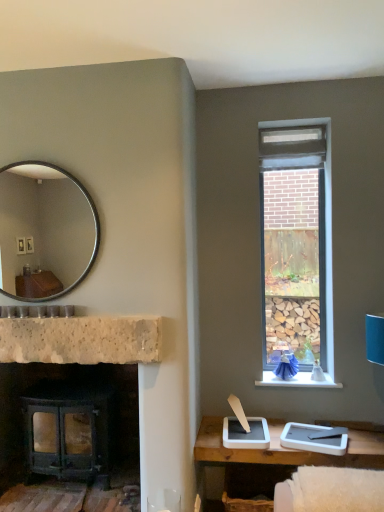
You are a GUI agent. You are given a task and a screenshot of the screen. Output one action in this format:
    pyautogui.click(x=<x>, y=<y>)
    Task: Click on the white stone window sill at upper right
    The image size is (384, 512).
    Given the screenshot: What is the action you would take?
    pyautogui.click(x=297, y=381)

Measure the distance between silver metallic mirror at upper left and camera.

silver metallic mirror at upper left and camera are 3.15 meters apart.

Measure the distance between matte black wood-burning stove at lower left and camera.

matte black wood-burning stove at lower left and camera are 2.28 meters apart.

Image resolution: width=384 pixels, height=512 pixels. What do you see at coordinates (81, 340) in the screenshot? I see `natural stone fireplace at center` at bounding box center [81, 340].

Locate an element on the screen. This screenshot has height=512, width=384. white stone window sill at upper right is located at coordinates (297, 381).

From a real-world perspective, relative to silver metallic mirror at upper left, is white stone window sill at upper right vertically above or below?

white stone window sill at upper right is below silver metallic mirror at upper left.

From the image's perspective, which is above, white stone window sill at upper right or silver metallic mirror at upper left?

silver metallic mirror at upper left.

Is white stone window sill at upper right to the left of silver metallic mirror at upper left from the viewer's perspective?

No, white stone window sill at upper right is not to the left of silver metallic mirror at upper left.

Could you tell me if white stone window sill at upper right is facing silver metallic mirror at upper left?

No, white stone window sill at upper right is not turned towards silver metallic mirror at upper left.

From a real-world perspective, between matte black wood-burning stove at lower left and white stone window sill at upper right, who is vertically lower?

matte black wood-burning stove at lower left.

Measure the distance from matte black wood-burning stove at lower left to white stone window sill at upper right.

matte black wood-burning stove at lower left and white stone window sill at upper right are 3.88 feet apart.

In the image, is matte black wood-burning stove at lower left positioned in front of or behind white stone window sill at upper right?

matte black wood-burning stove at lower left is in front of white stone window sill at upper right.

Is matte black wood-burning stove at lower left positioned with its back to natural stone fireplace at center?

matte black wood-burning stove at lower left does not have its back to natural stone fireplace at center.

Is matte black wood-burning stove at lower left to the left of natural stone fireplace at center from the viewer's perspective?

Yes.

Is matte black wood-burning stove at lower left not within natural stone fireplace at center?

Yes, matte black wood-burning stove at lower left is located beyond the bounds of natural stone fireplace at center.

Is silver metallic mirror at upper left to the left of white stone window sill at upper right from the viewer's perspective?

Yes.

From the image's perspective, between silver metallic mirror at upper left and white stone window sill at upper right, who is located below?

white stone window sill at upper right appears lower in the image.

Looking at this image, is silver metallic mirror at upper left oriented towards white stone window sill at upper right?

No, silver metallic mirror at upper left does not turn towards white stone window sill at upper right.

From a real-world perspective, is white stone window sill at upper right over matte black wood-burning stove at lower left?

Yes.

What's the angular difference between white stone window sill at upper right and matte black wood-burning stove at lower left's facing directions?

There is a 0.875-degree angle between the facing directions of white stone window sill at upper right and matte black wood-burning stove at lower left.

Is white stone window sill at upper right positioned before matte black wood-burning stove at lower left?

No, white stone window sill at upper right is behind matte black wood-burning stove at lower left.

In terms of size, does white stone window sill at upper right appear bigger or smaller than matte black wood-burning stove at lower left?

Clearly, white stone window sill at upper right is smaller in size than matte black wood-burning stove at lower left.

Is natural stone fireplace at center inside or outside of white stone window sill at upper right?

natural stone fireplace at center is outside white stone window sill at upper right.

Are natural stone fireplace at center and white stone window sill at upper right far apart?

natural stone fireplace at center is positioned a significant distance from white stone window sill at upper right.

How distant is natural stone fireplace at center from white stone window sill at upper right?

A distance of 3.86 feet exists between natural stone fireplace at center and white stone window sill at upper right.

From the image's perspective, is matte black wood-burning stove at lower left on top of silver metallic mirror at upper left?

No, from the image's perspective, matte black wood-burning stove at lower left is not over silver metallic mirror at upper left.

Do you think matte black wood-burning stove at lower left is within silver metallic mirror at upper left, or outside of it?

matte black wood-burning stove at lower left is spatially situated outside silver metallic mirror at upper left.

In the image, there is a white stone window sill at upper right. Identify the location of mirror above it (from the image's perspective). The height and width of the screenshot is (512, 384). (47, 226).

The width and height of the screenshot is (384, 512). I want to click on window sill that is on the right side of matte black wood-burning stove at lower left, so click(x=297, y=381).

Which object lies nearer to the anchor point white stone window sill at upper right, natural stone fireplace at center or matte black wood-burning stove at lower left?

natural stone fireplace at center is closer to white stone window sill at upper right.

Which object lies further to the anchor point matte black wood-burning stove at lower left, white stone window sill at upper right or natural stone fireplace at center?

Based on the image, white stone window sill at upper right appears to be further to matte black wood-burning stove at lower left.

Estimate the real-world distances between objects in this image. Which object is further from silver metallic mirror at upper left, matte black wood-burning stove at lower left or natural stone fireplace at center?

natural stone fireplace at center is further to silver metallic mirror at upper left.

Based on their spatial positions, is silver metallic mirror at upper left or matte black wood-burning stove at lower left closer to natural stone fireplace at center?

matte black wood-burning stove at lower left lies closer to natural stone fireplace at center than the other object.

Which object lies nearer to the anchor point natural stone fireplace at center, white stone window sill at upper right or matte black wood-burning stove at lower left?

Among the two, matte black wood-burning stove at lower left is located nearer to natural stone fireplace at center.

In the scene shown: When comparing their distances from silver metallic mirror at upper left, does matte black wood-burning stove at lower left or white stone window sill at upper right seem closer?

matte black wood-burning stove at lower left is positioned closer to the anchor silver metallic mirror at upper left.

From the image, which object appears to be nearer to matte black wood-burning stove at lower left, natural stone fireplace at center or silver metallic mirror at upper left?

Based on the image, natural stone fireplace at center appears to be nearer to matte black wood-burning stove at lower left.

Estimate the real-world distances between objects in this image. Which object is closer to white stone window sill at upper right, matte black wood-burning stove at lower left or natural stone fireplace at center?

natural stone fireplace at center is closer to white stone window sill at upper right.

Where is `mirror situated between matte black wood-burning stove at lower left and white stone window sill at upper right from left to right`? Image resolution: width=384 pixels, height=512 pixels. mirror situated between matte black wood-burning stove at lower left and white stone window sill at upper right from left to right is located at coordinates (47, 226).

The width and height of the screenshot is (384, 512). Identify the location of counter top that lies between silver metallic mirror at upper left and matte black wood-burning stove at lower left from top to bottom. (81, 340).

Find the location of `counter top situated between silver metallic mirror at upper left and white stone window sill at upper right from left to right`. counter top situated between silver metallic mirror at upper left and white stone window sill at upper right from left to right is located at coordinates (81, 340).

This screenshot has height=512, width=384. Find the location of `counter top between matte black wood-burning stove at lower left and white stone window sill at upper right from left to right`. counter top between matte black wood-burning stove at lower left and white stone window sill at upper right from left to right is located at coordinates (81, 340).